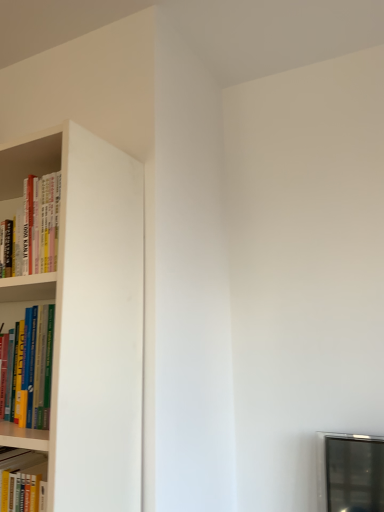
Question: From a real-world perspective, is hardcover books at left, the first book positioned from the front, physically located above or below hardcover books at left, the second book positioned from the bottom?

Choices:
 (A) above
 (B) below

Answer: (B)

Question: From the image's perspective, is hardcover books at left, the first book positioned from the front, located above or below hardcover books at left, the first book positioned from the back?

Choices:
 (A) below
 (B) above

Answer: (A)

Question: Is hardcover books at left, arranged as the first book when ordered from the bottom, taller or shorter than hardcover books at left, the 1th book viewed from the top?

Choices:
 (A) tall
 (B) short

Answer: (A)

Question: In terms of height, does hardcover books at left, the 1th book viewed from the top, look taller or shorter compared to hardcover books at left, arranged as the second book when viewed from the top?

Choices:
 (A) short
 (B) tall

Answer: (A)

Question: From the image's perspective, is hardcover books at left, the second book positioned from the bottom, located above or below hardcover books at left, arranged as the second book when viewed from the top?

Choices:
 (A) above
 (B) below

Answer: (A)

Question: Considering the positions of hardcover books at left, the first book positioned from the back, and hardcover books at left, arranged as the first book when ordered from the bottom, in the image, is hardcover books at left, the first book positioned from the back, wider or thinner than hardcover books at left, arranged as the first book when ordered from the bottom,?

Choices:
 (A) thin
 (B) wide

Answer: (B)

Question: Is point (24, 208) positioned closer to the camera than point (34, 414)?

Choices:
 (A) closer
 (B) farther

Answer: (B)